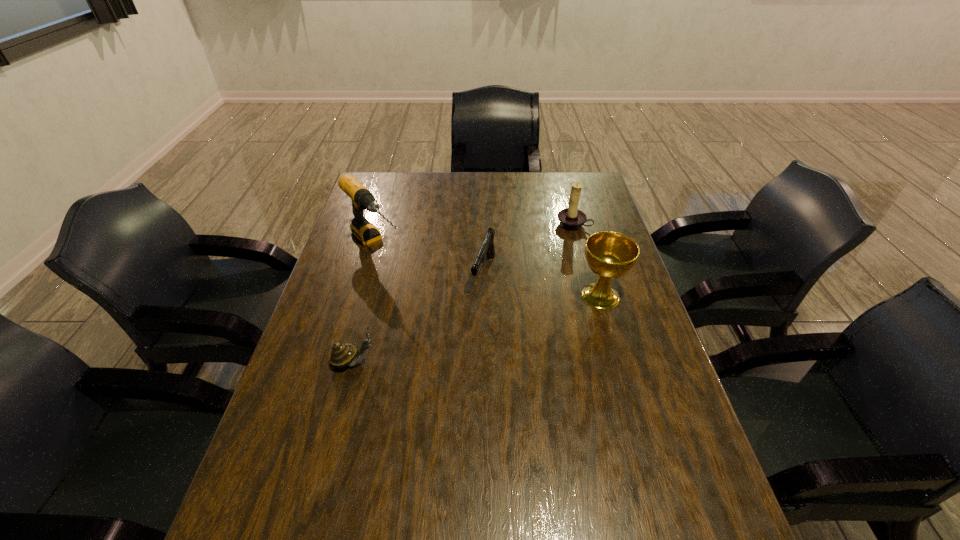
The image size is (960, 540). I want to click on blank area in the image that satisfies the following two spatial constraints: 1. on the front side of the snail; 2. on the face of the drill, so click(342, 362).